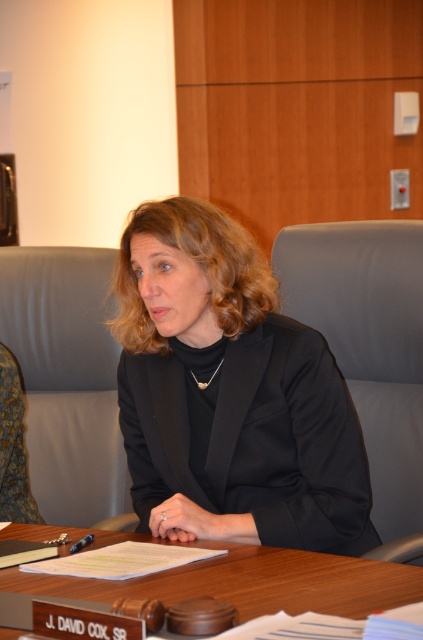
Question: Does black matte blazer at center appear under wooden table at center?

Choices:
 (A) yes
 (B) no

Answer: (B)

Question: Where is wooden table at center located in relation to blue plastic pen at center in the image?

Choices:
 (A) right
 (B) left

Answer: (A)

Question: Can you confirm if black matte blazer at center is bigger than wooden table at center?

Choices:
 (A) no
 (B) yes

Answer: (B)

Question: Which point is closer to the camera taking this photo?

Choices:
 (A) 373,588
 (B) 162,243
 (C) 91,536

Answer: (A)

Question: Estimate the real-world distances between objects in this image. Which object is closer to the blue plastic pen at center?

Choices:
 (A) black matte blazer at center
 (B) wooden table at center

Answer: (B)

Question: Which of these objects is positioned farthest from the wooden table at center?

Choices:
 (A) black matte blazer at center
 (B) blue plastic pen at center

Answer: (B)